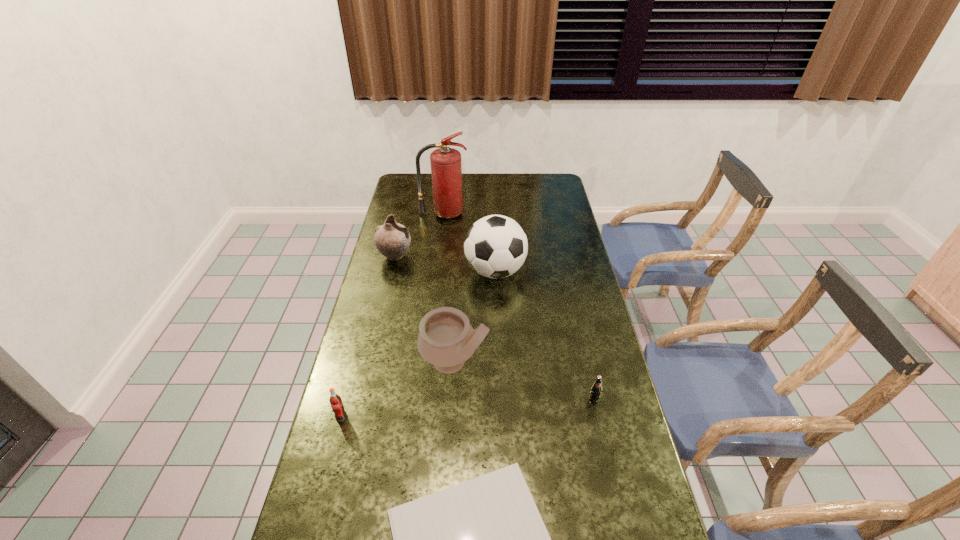
Find the location of a particular element. This screenshot has height=540, width=960. vacant space located at the front of the farthest object where the nozzle is aimed is located at coordinates (437, 272).

The image size is (960, 540). What are the coordinates of `free space located 0.110m on the right of the soccer ball` in the screenshot? It's located at (555, 271).

Locate an element on the screen. The image size is (960, 540). free space located on the front of the right pottery is located at coordinates (448, 468).

Identify the location of free region located from the spout of the farther pottery. (453, 256).

The width and height of the screenshot is (960, 540). I want to click on vacant space located 0.130m on the label of the left pop, so tap(327, 469).

This screenshot has height=540, width=960. What are the coordinates of `free space located on the front label of the rightmost object` in the screenshot? It's located at (617, 510).

Locate an element on the screen. fire extinguisher that is positioned at the left edge is located at coordinates click(x=446, y=169).

What are the coordinates of `pottery located at the left edge` in the screenshot? It's located at (392, 240).

This screenshot has width=960, height=540. In order to click on soda bottle present at the left edge in this screenshot , I will do `click(335, 400)`.

You are a GUI agent. You are given a task and a screenshot of the screen. Output one action in this format:
    pyautogui.click(x=<x>, y=<y>)
    Task: Click on the object that is positioned at the right edge
    The width and height of the screenshot is (960, 540).
    Given the screenshot: What is the action you would take?
    pyautogui.click(x=595, y=391)